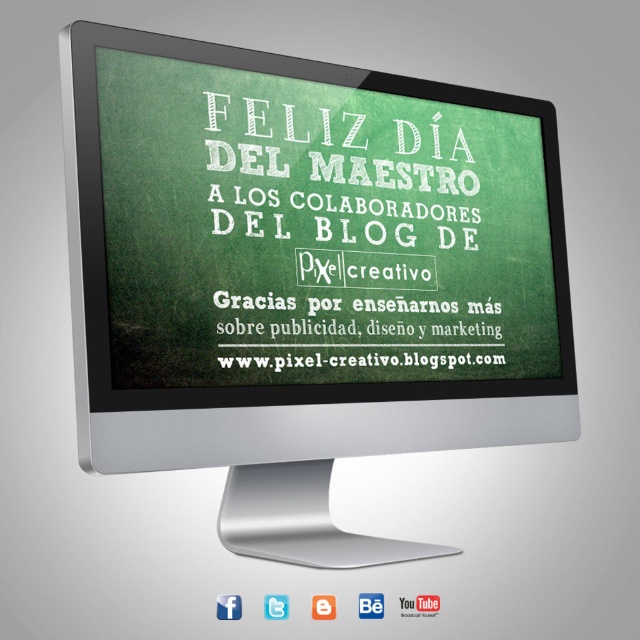
Image resolution: width=640 pixels, height=640 pixels. I want to click on silver metallic computer monitor at center, so click(x=305, y=275).

Is silver metallic computer monitor at center thinner than white chalkboard at center?

Incorrect, silver metallic computer monitor at center's width is not less than white chalkboard at center's.

Find the location of a particular element. This screenshot has width=640, height=640. silver metallic computer monitor at center is located at coordinates (305, 275).